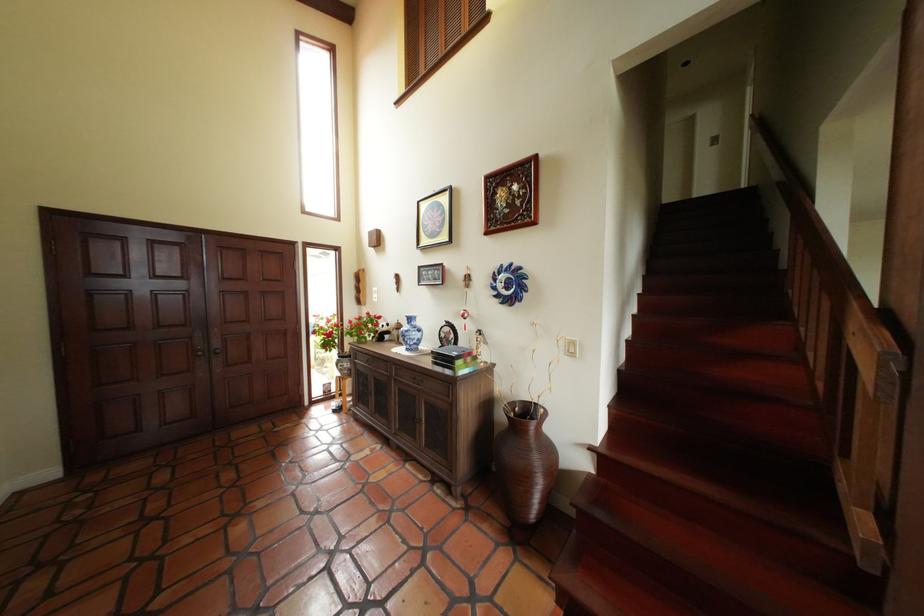
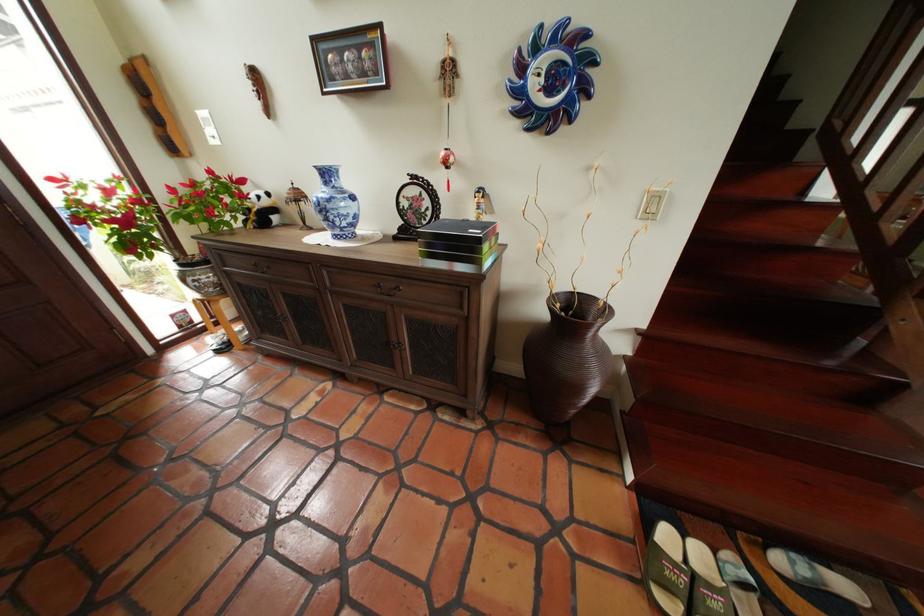
Where in the second image is the point corresponding to point (380, 363) from the first image?

(266, 269)